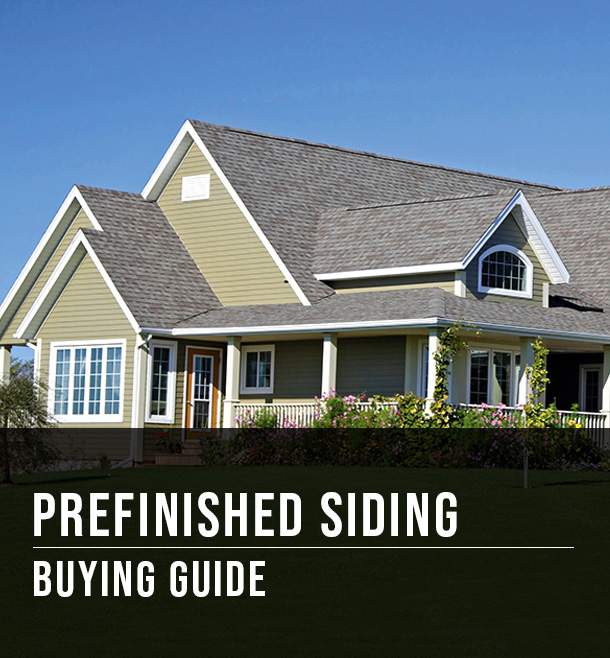
I want to click on column, so click(232, 357), click(325, 368), click(432, 374), click(525, 380), click(606, 389).